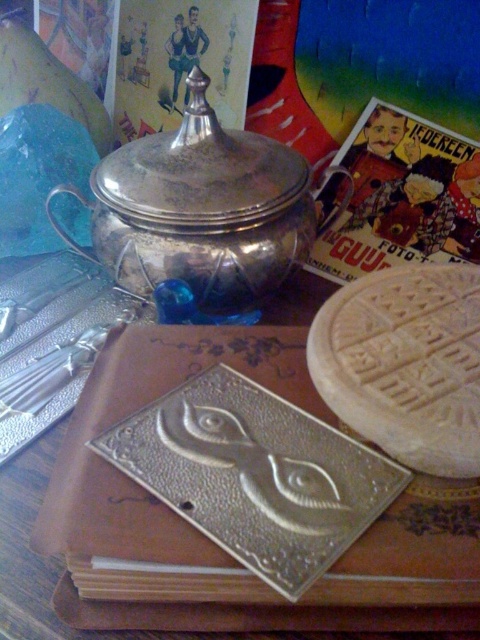
You are organizing a tea party and need to place a teacup between the shiny silver teapot at upper center and the matte paper book at upper right. Based on their positions, which object should the teacup be closer to?

The teacup should be placed closer to the shiny silver teapot at upper center because it is closer to the viewer than the matte paper book at upper right.

You are standing in front of the wooden surface and want to place a new item exactly at the point specified by the coordinates point (203, 209). What object is currently occupying that location?

The point (203, 209) corresponds to the shiny silver teapot at upper center, so placing a new item there would require moving the shiny silver teapot at upper center first.